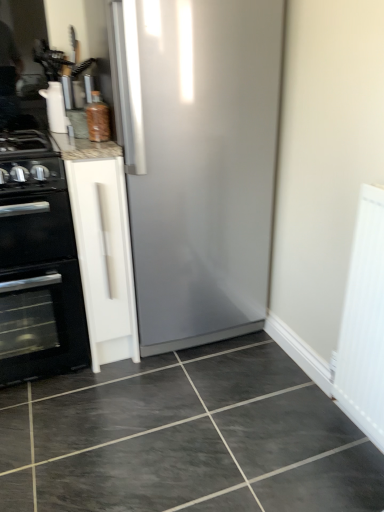
Question: Would you say dark gray glossy tile at center is outside white matte cabinet at left?

Choices:
 (A) yes
 (B) no

Answer: (A)

Question: Can you confirm if dark gray glossy tile at center is thinner than white matte cabinet at left?

Choices:
 (A) no
 (B) yes

Answer: (A)

Question: Would you say dark gray glossy tile at center contains white matte cabinet at left?

Choices:
 (A) no
 (B) yes

Answer: (A)

Question: Is dark gray glossy tile at center oriented away from white matte cabinet at left?

Choices:
 (A) no
 (B) yes

Answer: (A)

Question: From a real-world perspective, does dark gray glossy tile at center sit lower than white matte cabinet at left?

Choices:
 (A) yes
 (B) no

Answer: (A)

Question: From a real-world perspective, is dark gray glossy tile at center over white matte cabinet at left?

Choices:
 (A) no
 (B) yes

Answer: (A)

Question: Can you confirm if white matte cabinet at left is positioned to the right of dark gray glossy tile at center?

Choices:
 (A) no
 (B) yes

Answer: (A)

Question: Is white matte cabinet at left closer to camera compared to dark gray glossy tile at center?

Choices:
 (A) no
 (B) yes

Answer: (A)

Question: From a real-world perspective, is white matte cabinet at left beneath dark gray glossy tile at center?

Choices:
 (A) no
 (B) yes

Answer: (A)

Question: Does white matte cabinet at left contain dark gray glossy tile at center?

Choices:
 (A) no
 (B) yes

Answer: (A)

Question: From the image's perspective, is white matte cabinet at left above dark gray glossy tile at center?

Choices:
 (A) no
 (B) yes

Answer: (B)

Question: Is the position of white matte cabinet at left more distant than that of dark gray glossy tile at center?

Choices:
 (A) yes
 (B) no

Answer: (A)

Question: Does white matte cabinet at left appear on the left side of white textured radiator at right?

Choices:
 (A) no
 (B) yes

Answer: (B)